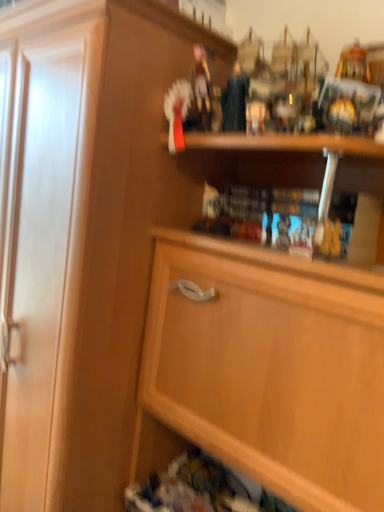
Question: Should I look upward or downward to see hardcover book at center?

Choices:
 (A) up
 (B) down

Answer: (A)

Question: Considering the relative positions of hardcover book at center and wooden cabinet at upper center in the image provided, is hardcover book at center to the left of wooden cabinet at upper center from the viewer's perspective?

Choices:
 (A) no
 (B) yes

Answer: (A)

Question: Is hardcover book at center located outside wooden cabinet at upper center?

Choices:
 (A) no
 (B) yes

Answer: (A)

Question: Is hardcover book at center closer to camera compared to wooden cabinet at upper center?

Choices:
 (A) no
 (B) yes

Answer: (A)

Question: Does hardcover book at center contain wooden cabinet at upper center?

Choices:
 (A) yes
 (B) no

Answer: (B)

Question: From the image's perspective, is hardcover book at center above wooden cabinet at upper center?

Choices:
 (A) yes
 (B) no

Answer: (A)

Question: Does hardcover book at center have a greater height compared to wooden cabinet at upper center?

Choices:
 (A) no
 (B) yes

Answer: (A)

Question: From a real-world perspective, does wooden cabinet at upper center sit lower than hardcover book at center?

Choices:
 (A) no
 (B) yes

Answer: (B)

Question: Can you confirm if wooden cabinet at upper center is thinner than hardcover book at center?

Choices:
 (A) yes
 (B) no

Answer: (B)

Question: Can you confirm if wooden cabinet at upper center is bigger than hardcover book at center?

Choices:
 (A) no
 (B) yes

Answer: (B)

Question: Could you tell me if wooden cabinet at upper center is turned towards hardcover book at center?

Choices:
 (A) yes
 (B) no

Answer: (B)

Question: From the image's perspective, is wooden cabinet at upper center located beneath hardcover book at center?

Choices:
 (A) yes
 (B) no

Answer: (A)

Question: Is wooden cabinet at upper center positioned before hardcover book at center?

Choices:
 (A) yes
 (B) no

Answer: (A)

Question: Considering the positions of hardcover book at center and wooden cabinet at upper center in the image, is hardcover book at center taller or shorter than wooden cabinet at upper center?

Choices:
 (A) short
 (B) tall

Answer: (A)